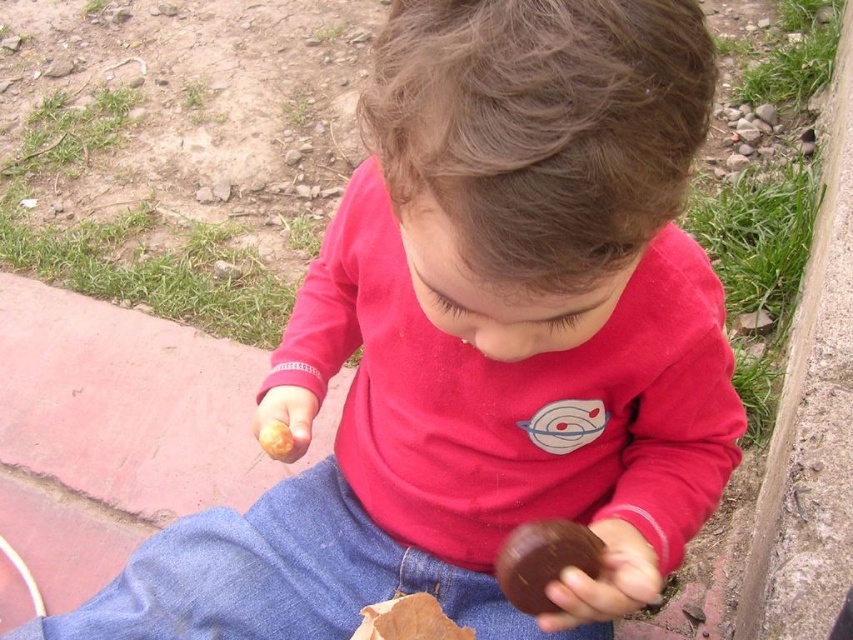
Question: Among these points, which one is farthest from the camera?

Choices:
 (A) (566, 563)
 (B) (265, 445)

Answer: (B)

Question: Among these objects, which one is farthest from the camera?

Choices:
 (A) yellow matte food at center
 (B) brown wooden ball at center

Answer: (A)

Question: Does brown wooden ball at center come behind yellow matte food at center?

Choices:
 (A) yes
 (B) no

Answer: (B)

Question: Which point is farther from the camera taking this photo?

Choices:
 (A) 525,595
 (B) 273,422

Answer: (B)

Question: Is brown wooden ball at center to the right of yellow matte food at center from the viewer's perspective?

Choices:
 (A) yes
 (B) no

Answer: (A)

Question: Can you confirm if brown wooden ball at center is positioned above yellow matte food at center?

Choices:
 (A) yes
 (B) no

Answer: (B)